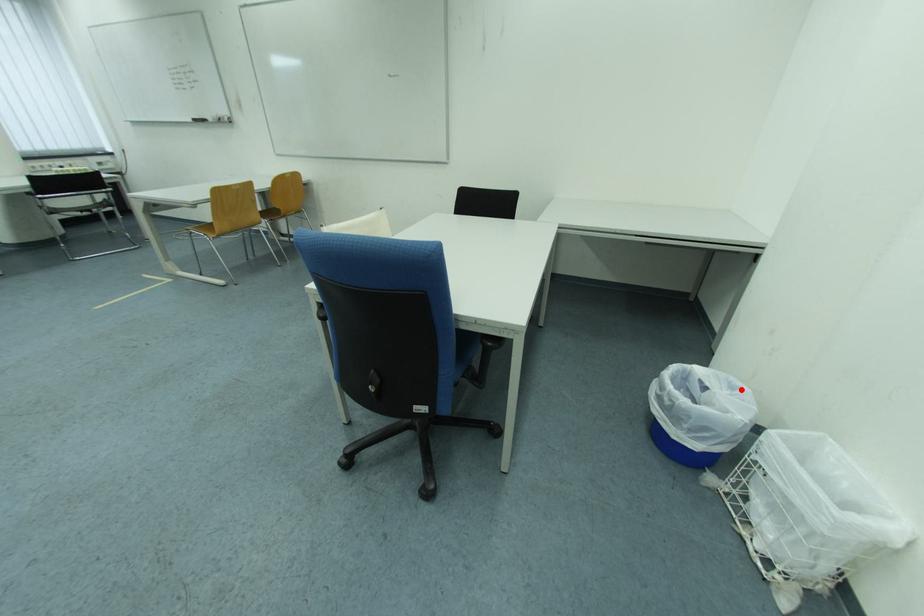
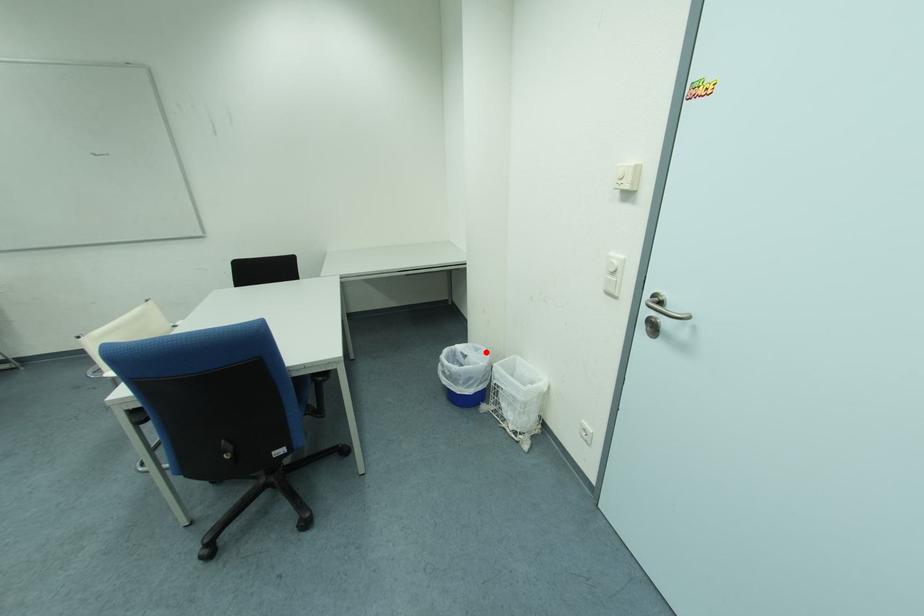
I am providing you with two images of the same scene from different viewpoints. A red point is marked on the first image and another point is marked on the second image. Do the highlighted points in image1 and image2 indicate the same real-world spot?

Yes